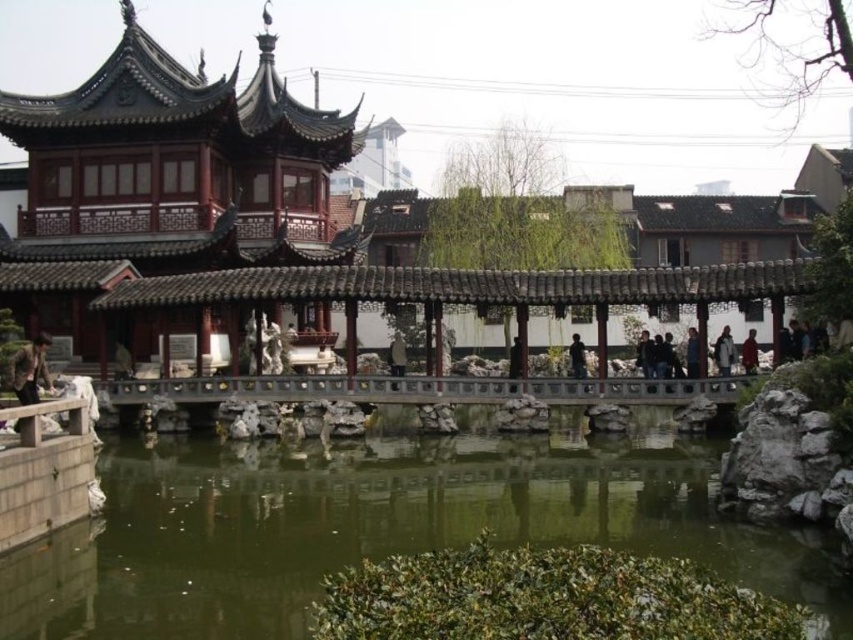
Consider the image. Does matte red wooden palace at center have a greater height compared to dark gray fabric coat at center?

Yes.

Which is more to the right, matte red wooden palace at center or dark gray fabric coat at center?

dark gray fabric coat at center

What do you see at coordinates (273, 243) in the screenshot? I see `matte red wooden palace at center` at bounding box center [273, 243].

Where is `matte red wooden palace at center`? matte red wooden palace at center is located at coordinates (273, 243).

Image resolution: width=853 pixels, height=640 pixels. What do you see at coordinates (577, 356) in the screenshot? I see `black matte person at center` at bounding box center [577, 356].

Who is positioned more to the right, black matte person at center or dark brown wooden figure at center?

From the viewer's perspective, black matte person at center appears more on the right side.

Between point (573, 362) and point (518, 369), which one is positioned behind?

The point (573, 362) is more distant.

The image size is (853, 640). Identify the location of black matte person at center. (577, 356).

Is green reflective water at center below brown leather jacket at lower left?

Indeed, green reflective water at center is positioned under brown leather jacket at lower left.

Is green reflective water at center positioned at the back of brown leather jacket at lower left?

No.

The width and height of the screenshot is (853, 640). What do you see at coordinates (374, 525) in the screenshot? I see `green reflective water at center` at bounding box center [374, 525].

Where is `green reflective water at center`? This screenshot has height=640, width=853. green reflective water at center is located at coordinates (374, 525).